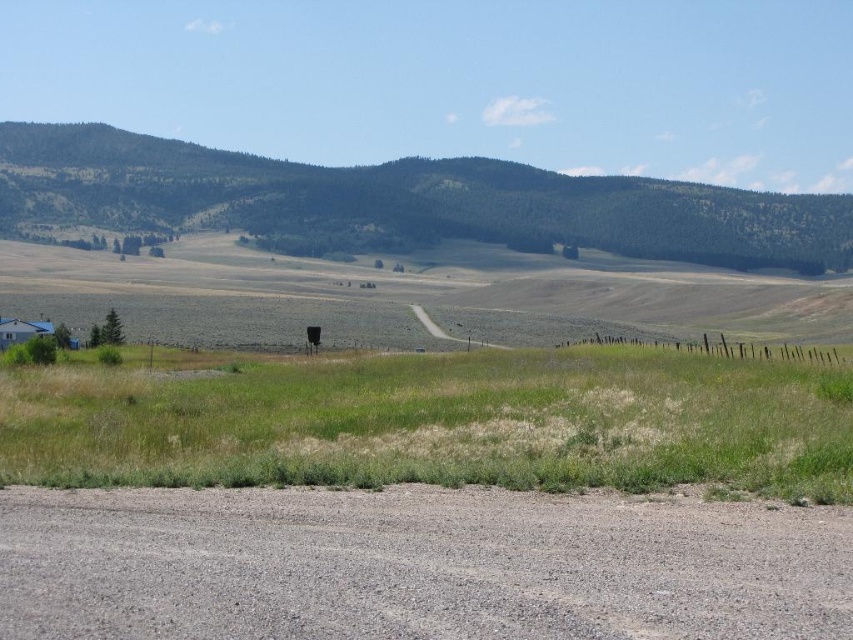
You are standing at the edge of the gray gravel dirt track at lower center and want to step onto the green grass at lower center. Which surface will feel higher under your foot?

The green grass at lower center is taller than the gray gravel dirt track at lower center, so stepping onto the green grass at lower center will feel higher under your foot.

You are a hiker planning to cross the gray gravel dirt track at lower center and the green grass at lower center. Since you want to choose the wider path, which one should you choose?

The green grass at lower center is wider than the gray gravel dirt track at lower center, so you should choose the green grass at lower center as the wider path.

You are a hiker standing on the gravel road and want to cross to the other side. The green grass at lower center and green forested mountain at upper center are in your view. Which of these two areas is wider from your perspective?

The green forested mountain at upper center is wider than the green grass at lower center from your perspective.